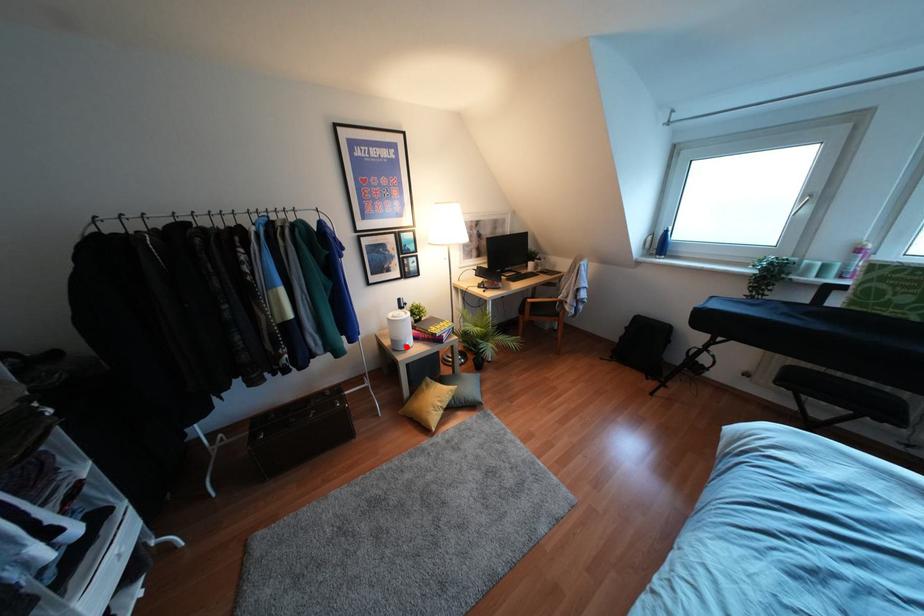
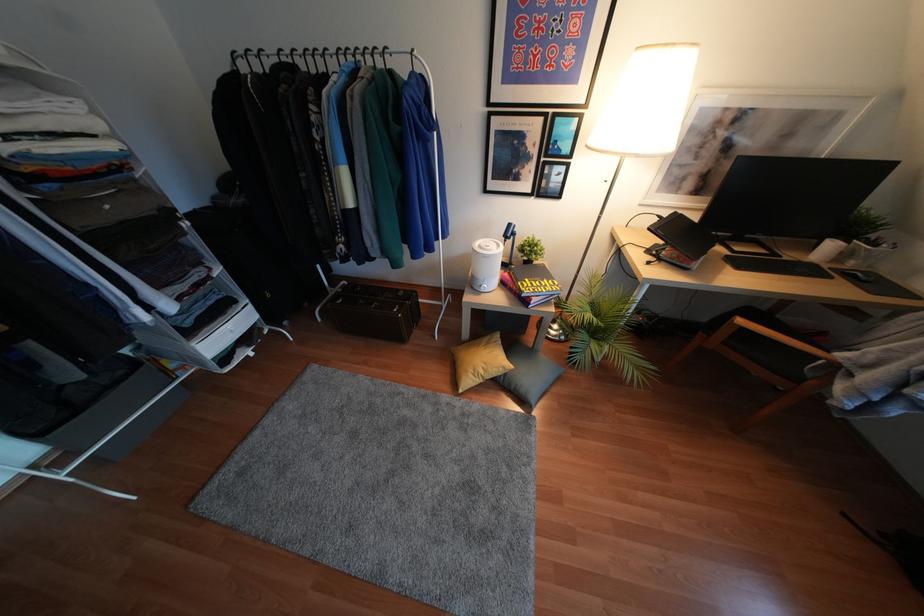
Question: I am providing you with two images of the same scene from different viewpoints. Given a red point in image1, look at the same physical point in image2. Is it:

Choices:
 (A) Closer to the viewpoint
 (B) Farther from the viewpoint

Answer: (A)